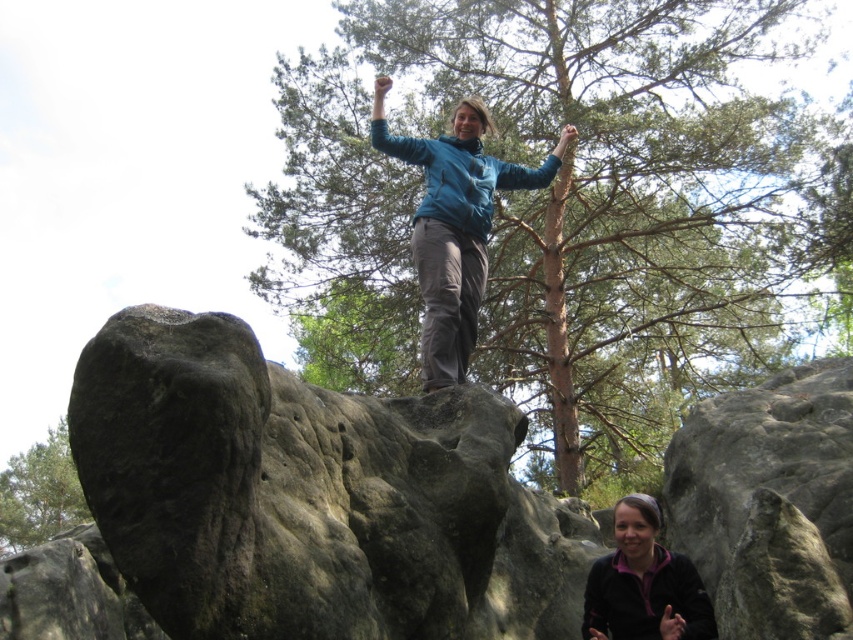
Does matte black jacket at lower center appear on the left side of green leafy tree at upper left?

In fact, matte black jacket at lower center is to the right of green leafy tree at upper left.

Between point (648, 612) and point (74, 509), which one is positioned behind?

The point (74, 509) is more distant.

The image size is (853, 640). Identify the location of matte black jacket at lower center. (643, 582).

Which is above, dark gray rough rock at center or green leafy tree at upper left?

Positioned higher is dark gray rough rock at center.

Who is more distant from viewer, (518, 444) or (22, 508)?

The point (22, 508) is more distant.

Locate an element on the screen. dark gray rough rock at center is located at coordinates (310, 497).

Is brown textured tree at upper center closer to the viewer compared to green leafy tree at upper left?

Yes.

Can you confirm if brown textured tree at upper center is thinner than green leafy tree at upper left?

No.

Where is `brown textured tree at upper center`? Image resolution: width=853 pixels, height=640 pixels. brown textured tree at upper center is located at coordinates (563, 209).